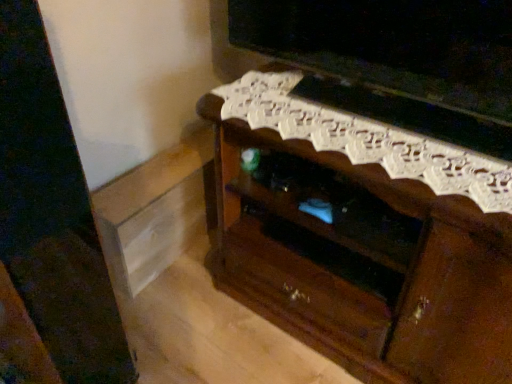
The height and width of the screenshot is (384, 512). What are the coordinates of `free point above brown wood cabinet at center (from a real-world perspective)` in the screenshot? It's located at (374, 126).